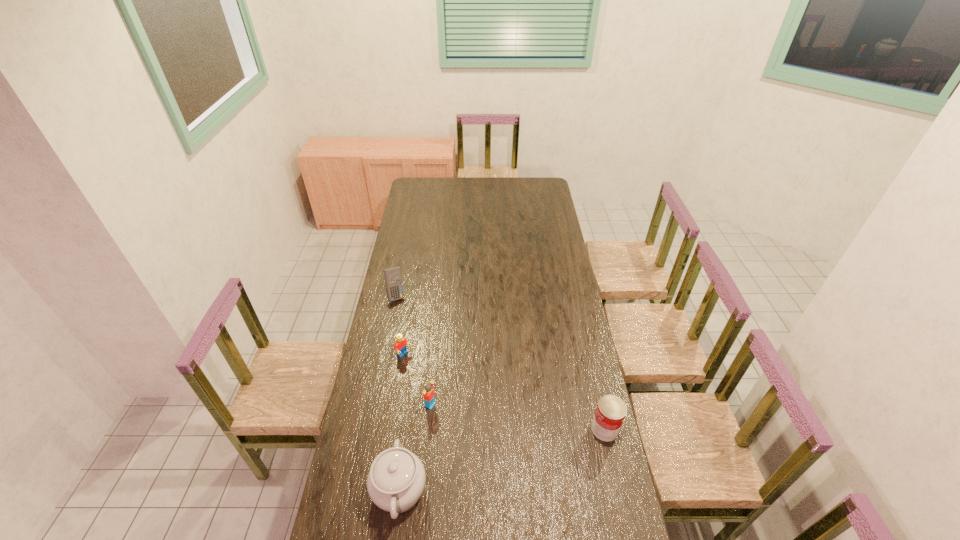
Identify the location of object that is the fourth closest one to the fourth farthest object. This screenshot has height=540, width=960. (393, 280).

Identify the location of free space that satisfies the following two spatial constraints: 1. on the back side of the third farthest object; 2. on the left side of the nearest object. (411, 404).

Where is `vacant position in the image that satisfies the following two spatial constraints: 1. on the front side of the calculator; 2. on the left side of the nearer Lego`? This screenshot has width=960, height=540. vacant position in the image that satisfies the following two spatial constraints: 1. on the front side of the calculator; 2. on the left side of the nearer Lego is located at coordinates (374, 404).

The height and width of the screenshot is (540, 960). I want to click on vacant space that satisfies the following two spatial constraints: 1. on the front side of the fourth farthest object; 2. on the front label of the left Lego, so click(393, 429).